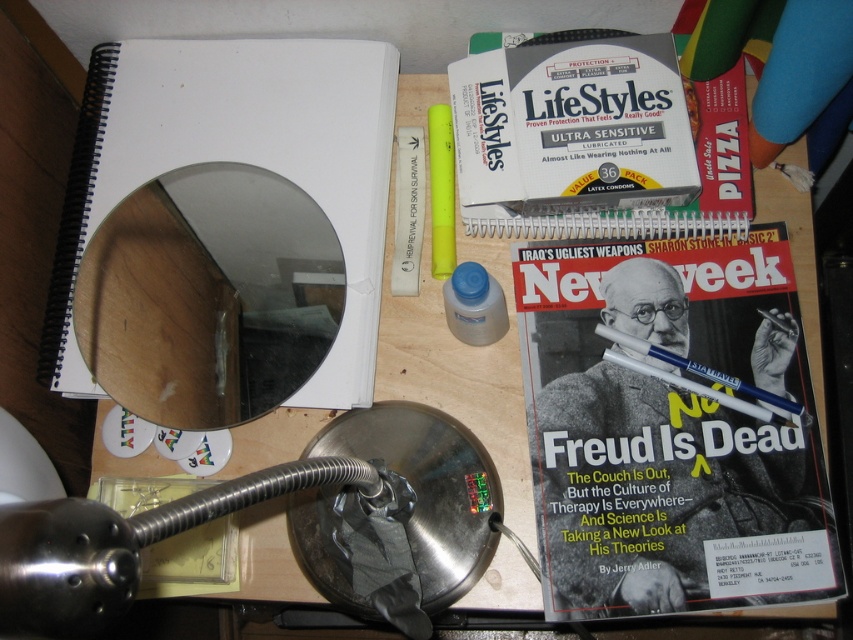
What is the 2D coordinate of the blue plastic pen at center?

The blue plastic pen at center is located at the 2D coordinate of point (704, 378).

You are standing at the edge of the desk and want to reach the point labeled as point (715, 467). However, there is an obstacle at point (450, 602). Can you directly reach the first point without moving the obstacle?

The point labeled point (715, 467) is behind point (450, 602), so you cannot directly reach it without moving the obstacle at point (450, 602).